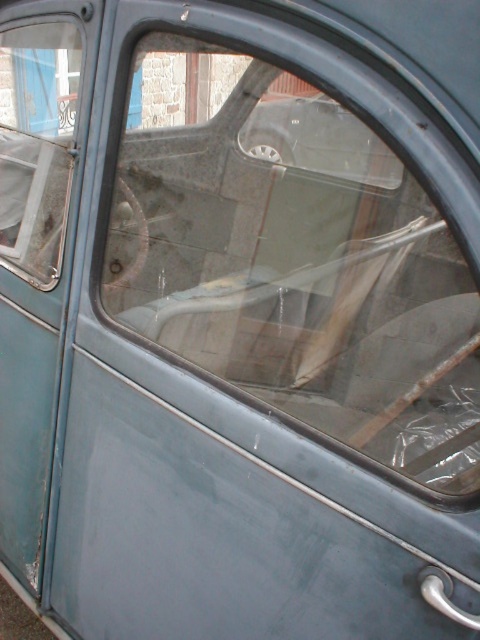
Question: Can you confirm if transparent plastic windshield at center is positioned to the right of transparent plastic window at upper left?

Choices:
 (A) no
 (B) yes

Answer: (B)

Question: Which object is farther from the camera taking this photo?

Choices:
 (A) transparent plastic window at upper left
 (B) transparent plastic windshield at center

Answer: (A)

Question: Which object is farther from the camera taking this photo?

Choices:
 (A) transparent plastic windshield at center
 (B) transparent plastic window at upper left

Answer: (B)

Question: Does transparent plastic windshield at center have a greater width compared to transparent plastic window at upper left?

Choices:
 (A) no
 (B) yes

Answer: (B)

Question: Does transparent plastic windshield at center have a larger size compared to transparent plastic window at upper left?

Choices:
 (A) yes
 (B) no

Answer: (A)

Question: Which of the following is the farthest from the observer?

Choices:
 (A) transparent plastic windshield at center
 (B) transparent plastic window at upper left

Answer: (B)